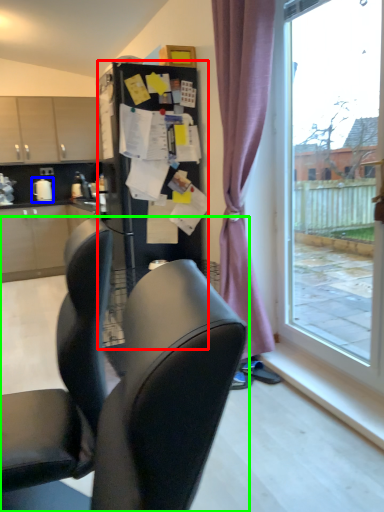
Question: Which is nearer to the fridge (highlighted by a red box)? appliance (highlighted by a blue box) or chair (highlighted by a green box).

Choices:
 (A) appliance
 (B) chair

Answer: (B)